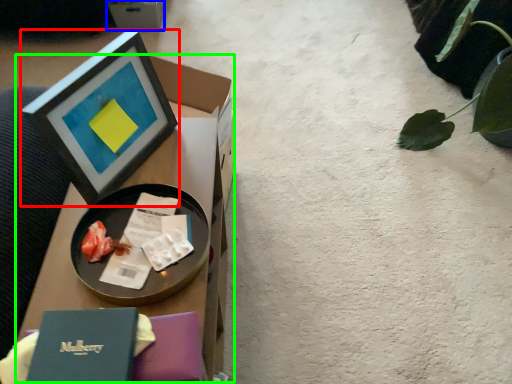
Question: Which object is positioned farthest from picture frame (highlighted by a red box)? Select from cardboard box (highlighted by a blue box) and table (highlighted by a green box).

Choices:
 (A) cardboard box
 (B) table

Answer: (A)